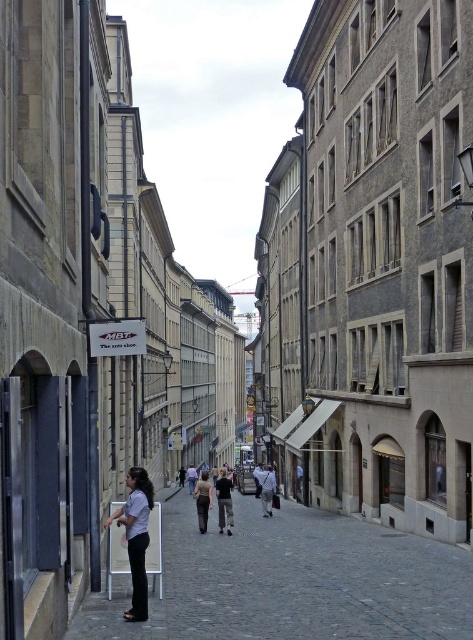
You are a tourist walking down the cobblestone street and notice a white paper at center and a light brown fabric shirt at center. Which object is nearer to you?

The white paper at center is closer to the viewer than the light brown fabric shirt at center.